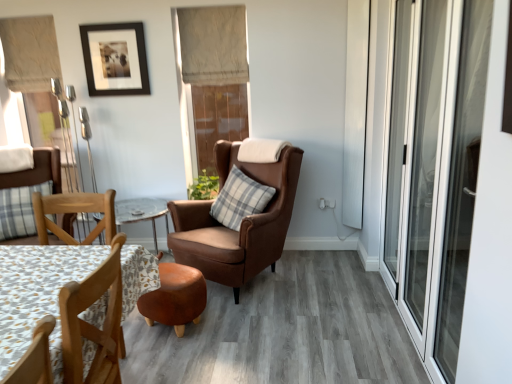
Locate an element on the screen. Image resolution: width=512 pixels, height=384 pixels. vacant point above beige fabric curtain at upper left, acting as the 1th curtain starting from the left (from a real-world perspective) is located at coordinates (18, 13).